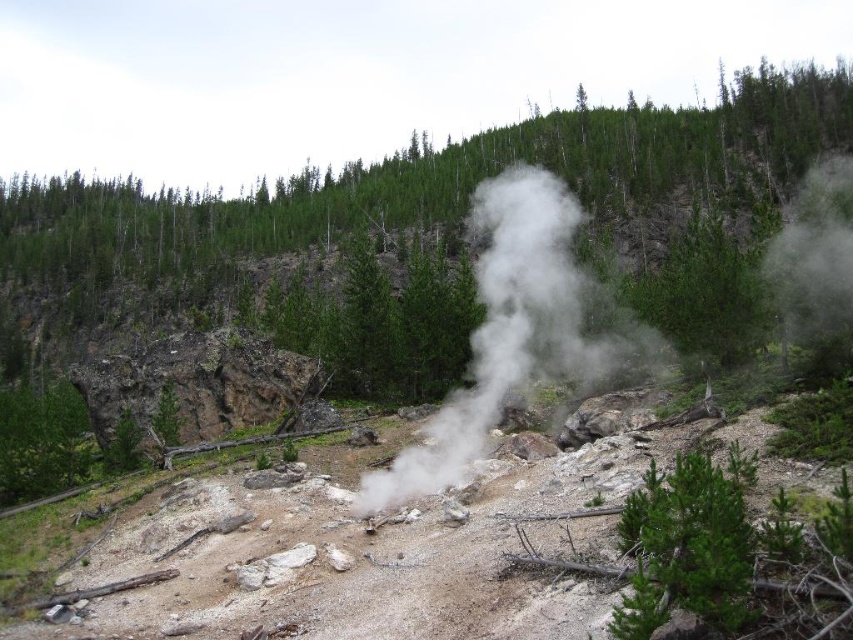
Is the position of white steam at center less distant than that of green matte tree at center?

Yes.

Find the location of a particular element. This screenshot has height=640, width=853. white steam at center is located at coordinates (509, 332).